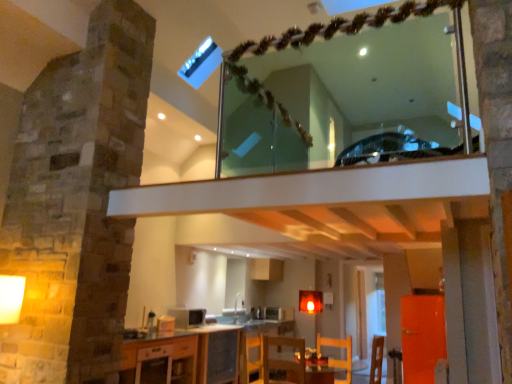
Question: In which direction should I rotate to look at wooden chair at lower center, which is counted as the 2th armchair, starting from the left?

Choices:
 (A) left
 (B) right

Answer: (B)

Question: From a real-world perspective, is wooden chair at lower center, which appears as the 1th armchair when viewed from the right, located higher than clear glass mirror at upper center?

Choices:
 (A) yes
 (B) no

Answer: (B)

Question: Is wooden chair at lower center, which is counted as the 2th armchair, starting from the left, wider than clear glass mirror at upper center?

Choices:
 (A) no
 (B) yes

Answer: (B)

Question: Can you confirm if wooden chair at lower center, which is counted as the 2th armchair, starting from the left, is smaller than clear glass mirror at upper center?

Choices:
 (A) no
 (B) yes

Answer: (B)

Question: Is wooden chair at lower center, which is counted as the 2th armchair, starting from the left, to the right of clear glass mirror at upper center from the viewer's perspective?

Choices:
 (A) yes
 (B) no

Answer: (A)

Question: Does wooden chair at lower center, which is counted as the 2th armchair, starting from the left, come behind clear glass mirror at upper center?

Choices:
 (A) yes
 (B) no

Answer: (A)

Question: Does wooden chair at lower center, which appears as the 1th armchair when viewed from the right, appear on the left side of clear glass mirror at upper center?

Choices:
 (A) no
 (B) yes

Answer: (A)

Question: Is white glossy cabinet at lower center to the left of matte white microwave at center, which appears as the 1th appliance when viewed from the front, from the viewer's perspective?

Choices:
 (A) yes
 (B) no

Answer: (A)

Question: Does white glossy cabinet at lower center have a lesser height compared to matte white microwave at center, the first appliance from the top?

Choices:
 (A) no
 (B) yes

Answer: (A)

Question: Are white glossy cabinet at lower center and matte white microwave at center, marked as the second appliance in a bottom-to-top arrangement, located far from each other?

Choices:
 (A) yes
 (B) no

Answer: (B)

Question: Is white glossy cabinet at lower center outside matte white microwave at center, which appears as the 1th appliance when viewed from the front?

Choices:
 (A) yes
 (B) no

Answer: (A)

Question: From the image's perspective, is white glossy cabinet at lower center located beneath matte white microwave at center, the first appliance from the top?

Choices:
 (A) no
 (B) yes

Answer: (B)

Question: From a real-world perspective, does white glossy cabinet at lower center stand above matte white microwave at center, marked as the second appliance in a bottom-to-top arrangement?

Choices:
 (A) yes
 (B) no

Answer: (B)

Question: Can you confirm if wooden chair at lower center, which appears as the 1th armchair when viewed from the left, is thinner than clear glass mirror at upper center?

Choices:
 (A) no
 (B) yes

Answer: (A)